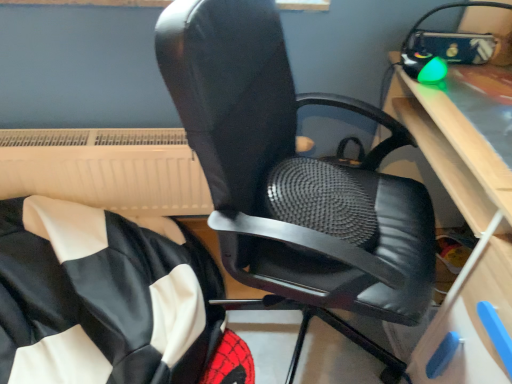
Question: From the image's perspective, is light wood computer desk at right over white plastic radiator at upper left?

Choices:
 (A) no
 (B) yes

Answer: (A)

Question: Is light wood computer desk at right at the left side of white plastic radiator at upper left?

Choices:
 (A) no
 (B) yes

Answer: (A)

Question: Does light wood computer desk at right contain white plastic radiator at upper left?

Choices:
 (A) no
 (B) yes

Answer: (A)

Question: Is there a large distance between light wood computer desk at right and white plastic radiator at upper left?

Choices:
 (A) yes
 (B) no

Answer: (B)

Question: Considering the relative sizes of light wood computer desk at right and white plastic radiator at upper left in the image provided, is light wood computer desk at right smaller than white plastic radiator at upper left?

Choices:
 (A) no
 (B) yes

Answer: (A)

Question: From a real-world perspective, is light wood computer desk at right below white plastic radiator at upper left?

Choices:
 (A) no
 (B) yes

Answer: (A)

Question: Is black leather chair at center positioned with its back to white plastic radiator at upper left?

Choices:
 (A) no
 (B) yes

Answer: (B)

Question: Could you tell me if black leather chair at center is facing white plastic radiator at upper left?

Choices:
 (A) yes
 (B) no

Answer: (B)

Question: Considering the relative sizes of black leather chair at center and white plastic radiator at upper left in the image provided, is black leather chair at center wider than white plastic radiator at upper left?

Choices:
 (A) no
 (B) yes

Answer: (B)

Question: Can you confirm if black leather chair at center is thinner than white plastic radiator at upper left?

Choices:
 (A) no
 (B) yes

Answer: (A)

Question: Is the position of black leather chair at center less distant than that of white plastic radiator at upper left?

Choices:
 (A) no
 (B) yes

Answer: (B)

Question: Considering the relative positions of black leather chair at center and white plastic radiator at upper left in the image provided, is black leather chair at center to the right of white plastic radiator at upper left from the viewer's perspective?

Choices:
 (A) yes
 (B) no

Answer: (A)

Question: Does white plastic radiator at upper left appear on the left side of light wood computer desk at right?

Choices:
 (A) no
 (B) yes

Answer: (B)